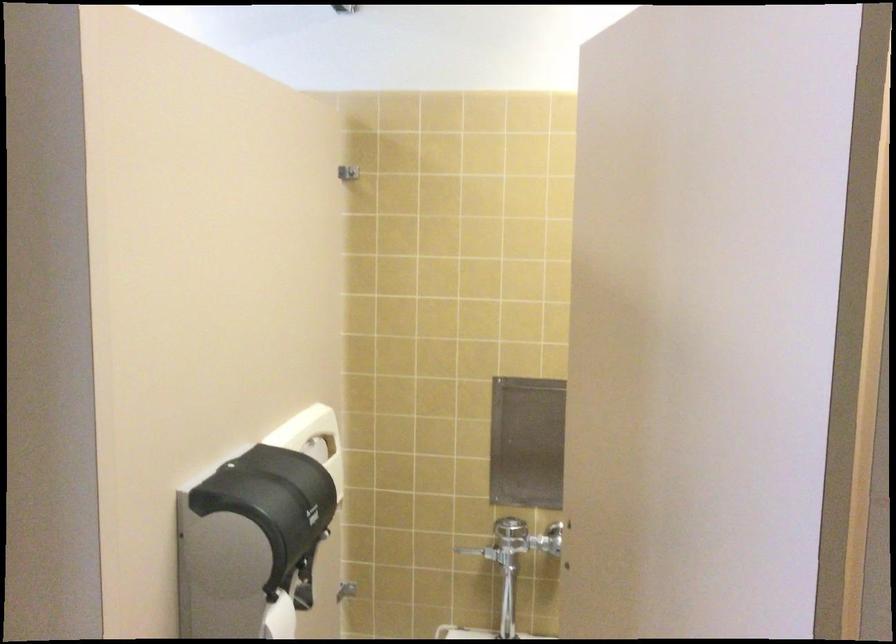
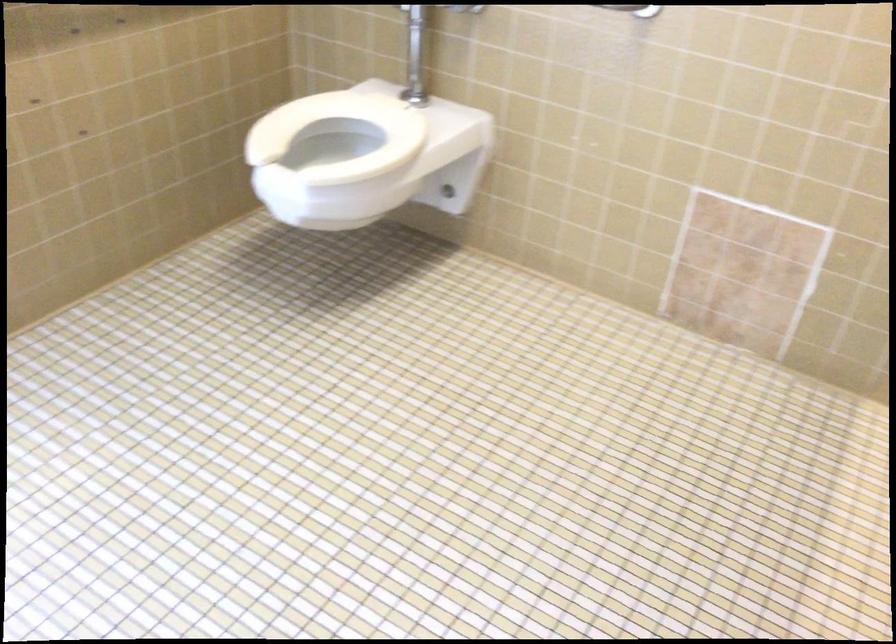
Consider the image. The images are taken continuously from a first-person perspective. In which direction is your viewpoint rotating?

The camera rotated toward left-down.